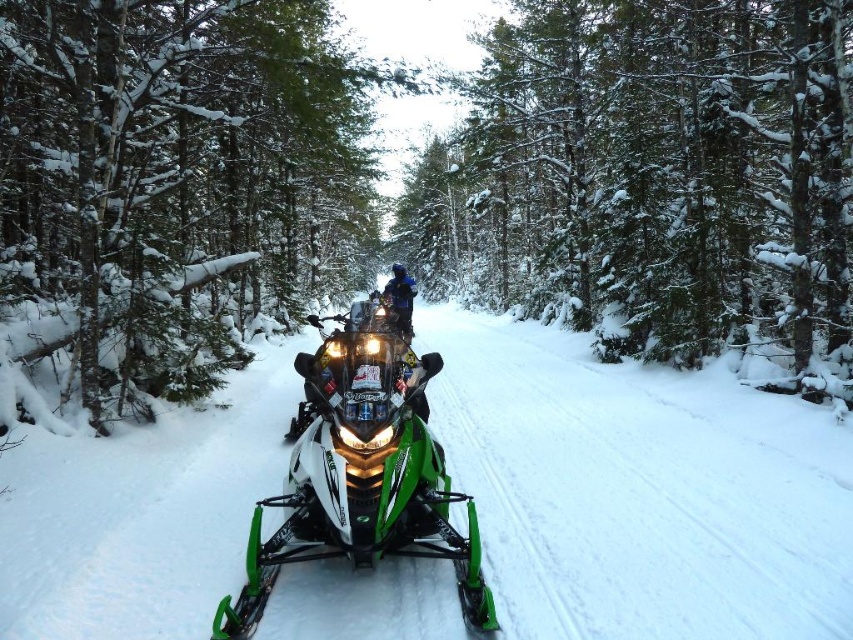
You are a snowmobiler planning to take a photo of the green matte tree at center and the blue fabric jacket at center. Which object should you focus on first if you want both to be in sharp focus?

The green matte tree at center is bigger than the blue fabric jacket at center, so you should focus on the green matte tree at center first to ensure both are in sharp focus.

You are planning to park your snowmobile in a space that can only accommodate vehicles narrower than the blue fabric jacket at center. Can the green textured snowmobile at center fit in that space?

The green textured snowmobile at center is wider than the blue fabric jacket at center, so it cannot fit in the parking space designed for narrower vehicles.